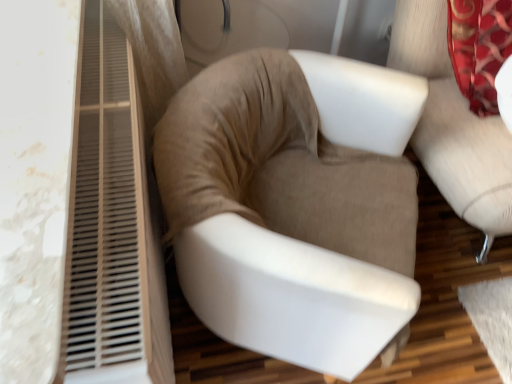
Question: Considering the relative positions of suede beige armchair at center, the 1th chair positioned from the right, and suede-like beige chair at center, the second chair when ordered from right to left, in the image provided, is suede beige armchair at center, the 1th chair positioned from the right, to the left or to the right of suede-like beige chair at center, the second chair when ordered from right to left,?

Choices:
 (A) right
 (B) left

Answer: (A)

Question: From their relative heights in the image, would you say suede beige armchair at center, the 1th chair positioned from the right, is taller or shorter than suede-like beige chair at center, the second chair when ordered from right to left?

Choices:
 (A) short
 (B) tall

Answer: (B)

Question: From the image's perspective, relative to suede-like beige chair at center, the second chair when ordered from right to left, is suede beige armchair at center, the 1th chair positioned from the right, above or below?

Choices:
 (A) above
 (B) below

Answer: (A)

Question: Is suede-like beige chair at center, the first chair positioned from the left, inside or outside of suede beige armchair at center, the 1th chair positioned from the right?

Choices:
 (A) outside
 (B) inside

Answer: (A)

Question: Does point (373, 165) appear closer or farther from the camera than point (394, 29)?

Choices:
 (A) closer
 (B) farther

Answer: (A)

Question: Considering the positions of suede-like beige chair at center, the first chair positioned from the left, and suede beige armchair at center, the 1th chair positioned from the right, in the image, is suede-like beige chair at center, the first chair positioned from the left, wider or thinner than suede beige armchair at center, the 1th chair positioned from the right,?

Choices:
 (A) thin
 (B) wide

Answer: (A)

Question: From the image's perspective, is suede-like beige chair at center, the first chair positioned from the left, located above or below suede beige armchair at center, the 1th chair positioned from the right?

Choices:
 (A) above
 (B) below

Answer: (B)